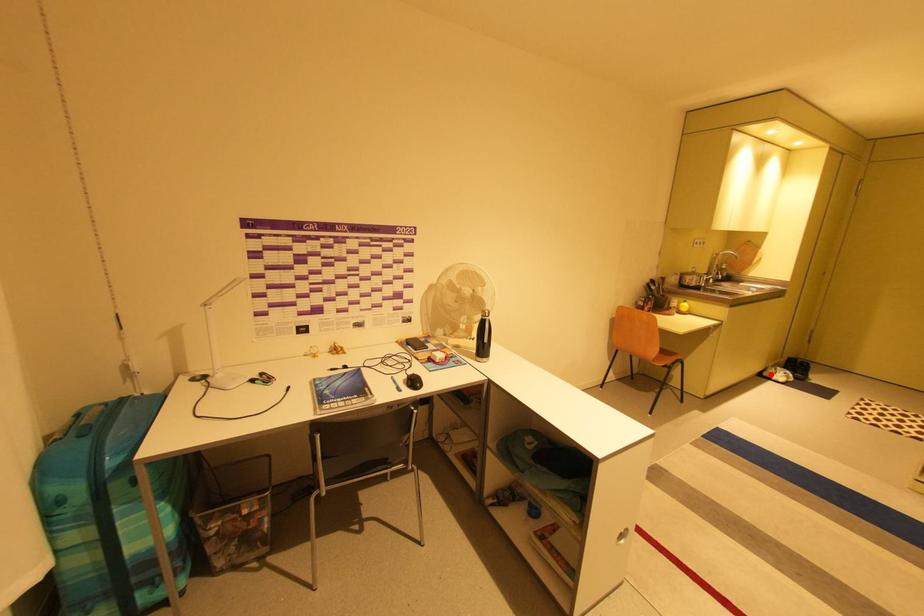
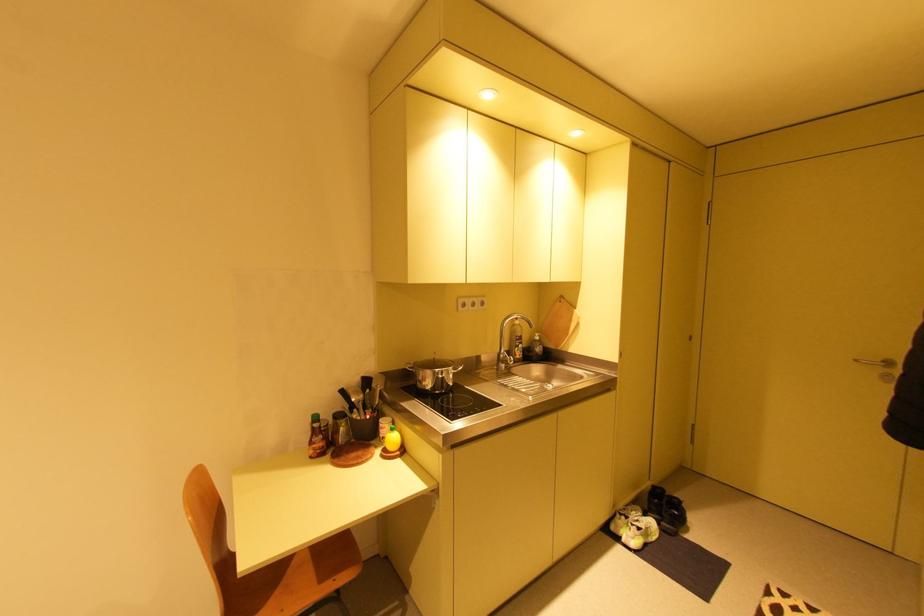
In the second image, find the point that corresponds to the highlighted location in the first image.

(617, 528)